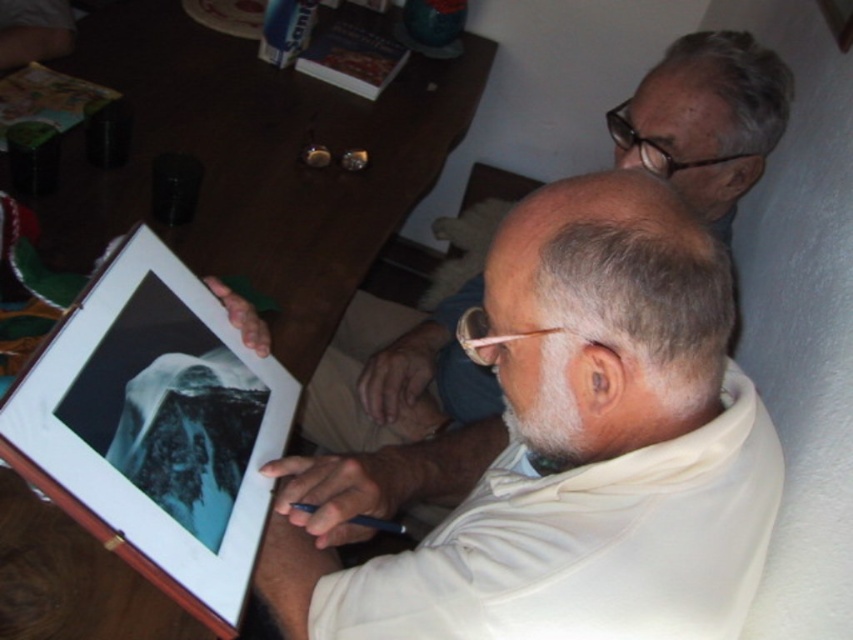
You are an observer in the room where both the white matte shirt at center and the white matte shirt at upper right are visible. Which of the two shirts appears taller in the image?

The white matte shirt at center appears taller than the white matte shirt at upper right.

You are observing two people examining a photograph. You notice a white matte shirt at center and a white matte shirt at upper right. Which one is more to the right?

The white matte shirt at center is more to the right because it is positioned on the right side of the white matte shirt at upper right.

You are a photographer standing 24 inches away from the white matte shirt at center. Can you take a clear photo of it without moving closer?

The white matte shirt at center and viewer are 22.56 inches apart. Since you are 24 inches away, you are slightly farther than the minimum distance required for a clear photo. Move closer by about 1.44 inches to ensure clarity.